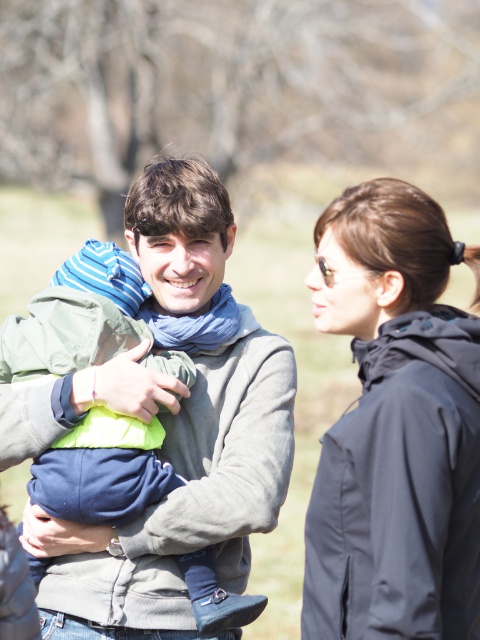
Locate an element on the screen. This screenshot has width=480, height=640. black matte jacket at right is located at coordinates (395, 428).

Where is `black matte jacket at right`? Image resolution: width=480 pixels, height=640 pixels. black matte jacket at right is located at coordinates (395, 428).